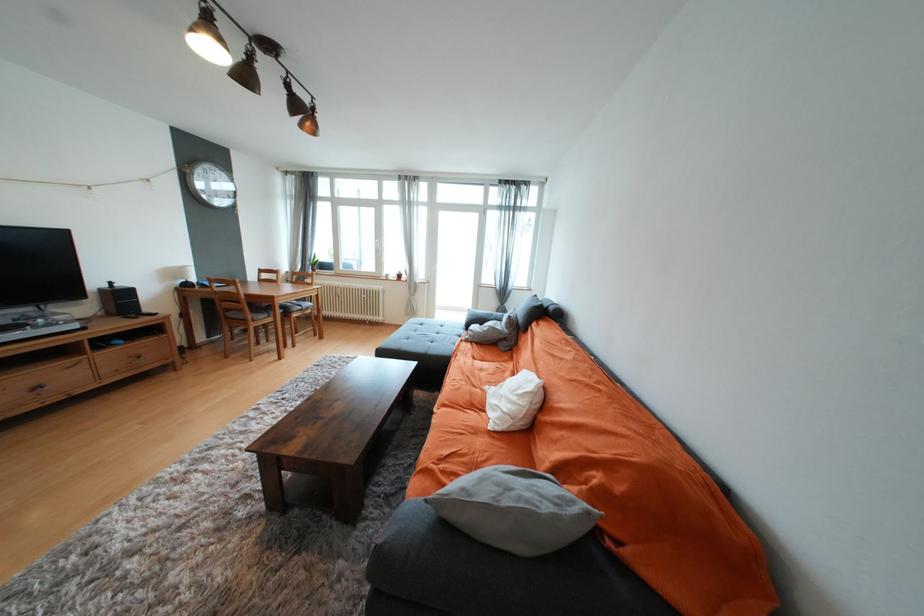
At what (x,y) coordinates should I click in order to perform the action: click on sofa sitting surface. Please return your answer as a coordinate pair (x, y). Looking at the image, I should click on (471, 416).